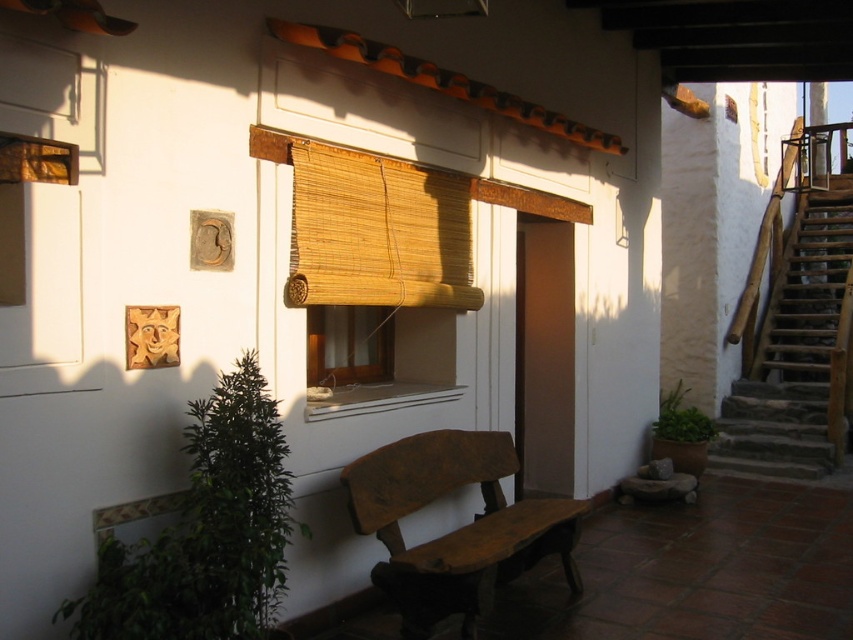
You are standing at the center of the scene and want to place a new decorative item exactly at the coordinates given for the green leafy plant at lower left. What object is currently occupying that location?

The green leafy plant at lower left is currently occupying the coordinates at point (206, 532).

You are a painter who wants to paint the wooden stairs at right and the bamboo mat at center. If you use the same amount of paint for both, which object will require more coats to cover completely?

The wooden stairs at right is bigger than the bamboo mat at center, so it will require more coats of paint to cover completely when using the same amount of paint.